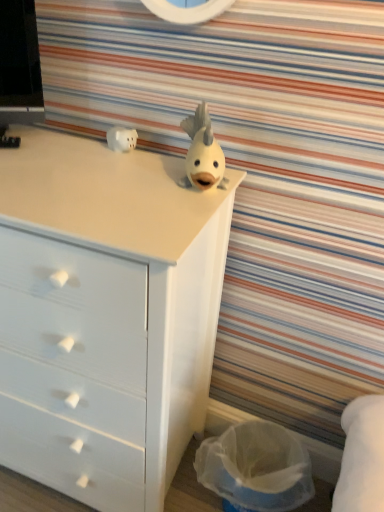
Locate an element on the screen. This screenshot has height=512, width=384. vacant space in front of white matte fish at center, positioned as the second toy in left-to-right order is located at coordinates (166, 210).